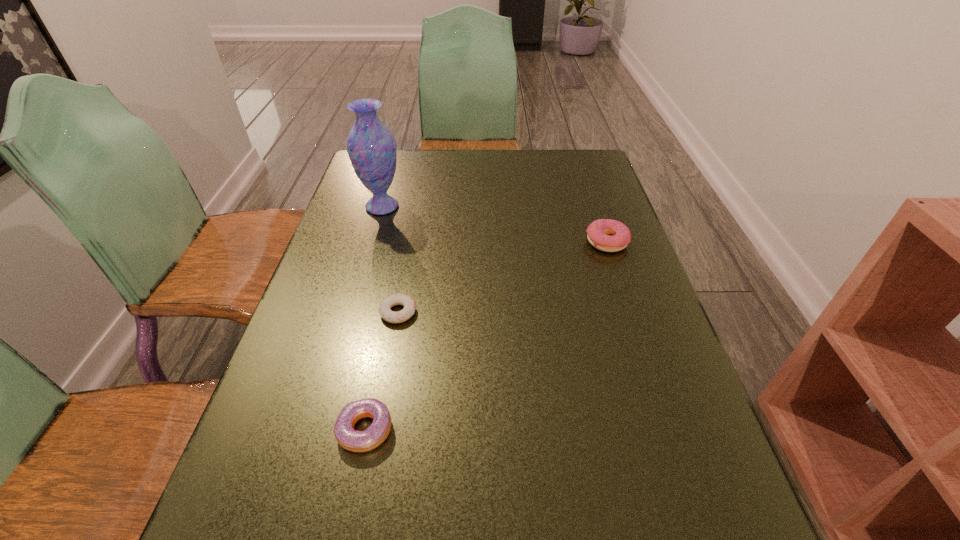
At what (x,y) coordinates should I click in order to perform the action: click on blank space located 0.200m on the back of the second farthest doughnut. Please return your answer as a coordinate pair (x, y). Looking at the image, I should click on (411, 244).

I want to click on vase positioned at the left edge, so click(x=371, y=146).

The height and width of the screenshot is (540, 960). I want to click on doughnut that is at the left edge, so click(347, 437).

Locate an element on the screen. object that is at the right edge is located at coordinates (598, 231).

Locate an element on the screen. vacant space at the far edge of the desktop is located at coordinates (447, 181).

Identify the location of vacant region at the left edge of the desktop. The height and width of the screenshot is (540, 960). (372, 242).

Where is `vacant space at the right edge of the desktop`? The width and height of the screenshot is (960, 540). vacant space at the right edge of the desktop is located at coordinates (658, 390).

Locate an element on the screen. free space between the second nearest doughnut and the farthest doughnut is located at coordinates (503, 277).

Identify the location of free space between the nearest object and the farthest object. The height and width of the screenshot is (540, 960). (373, 318).

Identify the location of empty location between the second farthest object and the nearest doughnut. (486, 336).